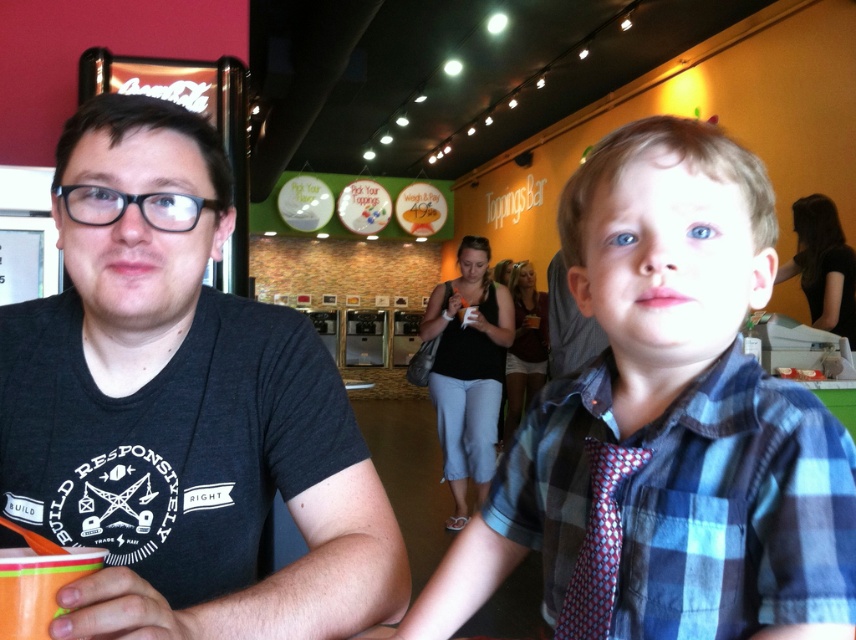
Is blue plaid shirt at center to the left of black shirt at upper right from the viewer's perspective?

Indeed, blue plaid shirt at center is positioned on the left side of black shirt at upper right.

Is the position of blue plaid shirt at center less distant than that of black shirt at upper right?

Yes, blue plaid shirt at center is closer to the viewer.

What do you see at coordinates (666, 424) in the screenshot? I see `blue plaid shirt at center` at bounding box center [666, 424].

Locate an element on the screen. The image size is (856, 640). blue plaid shirt at center is located at coordinates (666, 424).

Is dark gray t-shirt at left in front of black shirt at upper right?

Yes, dark gray t-shirt at left is in front of black shirt at upper right.

Which is in front, point (204, 573) or point (843, 328)?

Positioned in front is point (204, 573).

Between point (242, 481) and point (811, 289), which one is positioned in front?

Point (242, 481)

This screenshot has height=640, width=856. I want to click on dark gray t-shirt at left, so click(x=180, y=408).

In the scene shown: Does blue plaid shirt at right have a lesser width compared to black cotton tank top at center?

Yes.

Measure the distance between blue plaid shirt at right and camera.

A distance of 17.18 inches exists between blue plaid shirt at right and camera.

Which is in front, point (795, 557) or point (484, 497)?

Point (795, 557) is in front.

Locate an element on the screen. The height and width of the screenshot is (640, 856). blue plaid shirt at right is located at coordinates (693, 502).